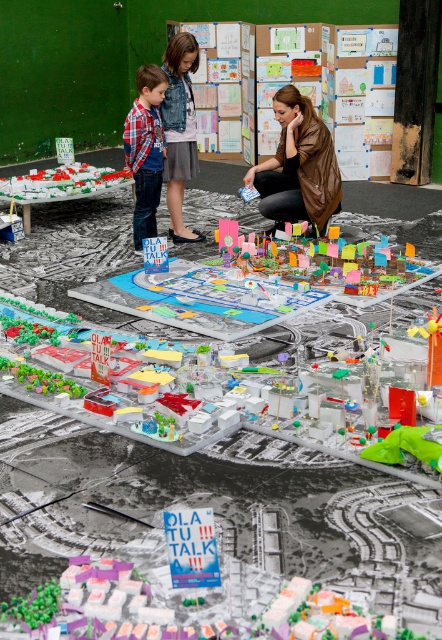
Does brown leather jacket at center appear over colorful plastic cityscape at center?

Correct, brown leather jacket at center is located above colorful plastic cityscape at center.

Which is in front, point (319, 154) or point (422, 280)?

Point (422, 280) is in front.

You are a GUI agent. You are given a task and a screenshot of the screen. Output one action in this format:
    pyautogui.click(x=<x>, y=<y>)
    Task: Click on the brown leather jacket at center
    This screenshot has height=640, width=442.
    Given the screenshot: What is the action you would take?
    pyautogui.click(x=298, y=164)

Based on the photo, is brown leather jacket at center shorter than brown leather jacket at upper center?

Yes.

Identify the location of brown leather jacket at center. The width and height of the screenshot is (442, 640). tap(298, 164).

Does point (271, 212) come closer to viewer compared to point (182, 156)?

Yes, point (271, 212) is in front of point (182, 156).

This screenshot has height=640, width=442. What are the coordinates of `brown leather jacket at center` in the screenshot? It's located at (298, 164).

Can you confirm if brown leather jacket at upper center is smaller than plaid shirt at center?

Incorrect, brown leather jacket at upper center is not smaller in size than plaid shirt at center.

Between brown leather jacket at upper center and plaid shirt at center, which one has more height?

With more height is brown leather jacket at upper center.

Where is `brown leather jacket at upper center`? brown leather jacket at upper center is located at coordinates (179, 131).

Where is `brown leather jacket at upper center`? The image size is (442, 640). brown leather jacket at upper center is located at coordinates (179, 131).